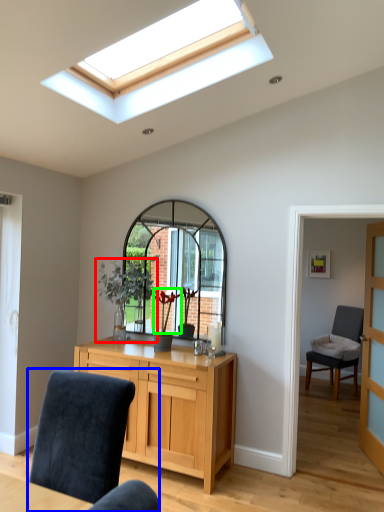
Question: Which object is positioned farthest from houseplant (highlighted by a red box)? Select from chair (highlighted by a blue box) and flower (highlighted by a green box).

Choices:
 (A) chair
 (B) flower

Answer: (A)